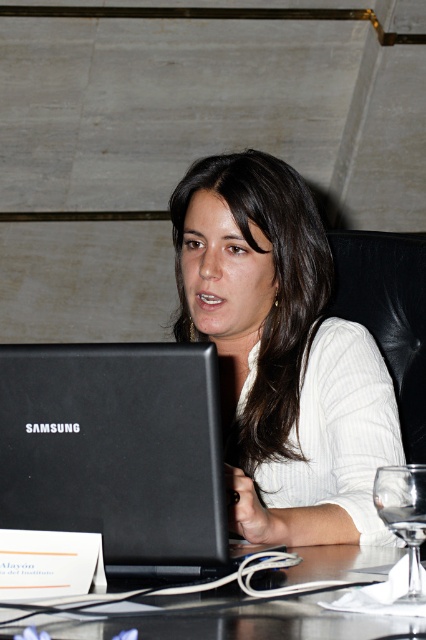
Question: Which object appears closest to the camera in this image?

Choices:
 (A) white matte shirt at center
 (B) white ribbed sweater at center

Answer: (A)

Question: Among these objects, which one is farthest from the camera?

Choices:
 (A) transparent glass at lower right
 (B) white matte shirt at center
 (C) black matte laptop at center

Answer: (B)

Question: Which object is farther from the camera taking this photo?

Choices:
 (A) black matte laptop at center
 (B) black glossy table at center

Answer: (A)

Question: Can you confirm if black glossy table at center is smaller than transparent glass at lower right?

Choices:
 (A) yes
 (B) no

Answer: (B)

Question: Observing the image, what is the correct spatial positioning of white ribbed sweater at center in reference to transparent glass at lower right?

Choices:
 (A) above
 (B) below

Answer: (A)

Question: Is black glossy table at center to the left of transparent glass at lower right from the viewer's perspective?

Choices:
 (A) yes
 (B) no

Answer: (A)